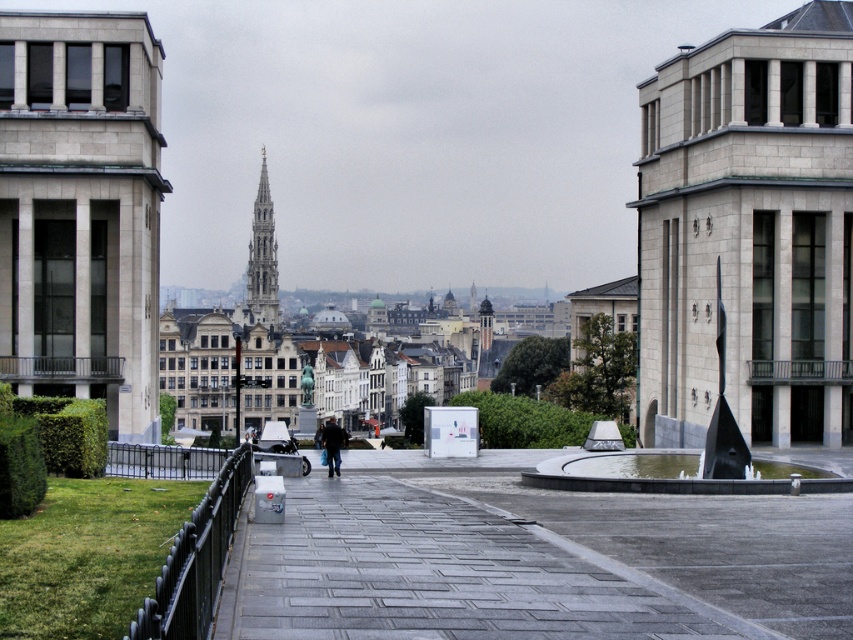
Looking at this image, between gray concrete pavement at center and dark blue jeans at center, which one appears on the right side from the viewer's perspective?

Positioned to the right is gray concrete pavement at center.

Identify the location of gray concrete pavement at center. The height and width of the screenshot is (640, 853). click(x=438, y=573).

Find the location of a particular element. This screenshot has height=640, width=853. gray concrete pavement at center is located at coordinates [438, 573].

Which is below, gray stone sculpture at right or gray concrete pavement at center?

gray concrete pavement at center is below.

Who is taller, gray stone sculpture at right or gray concrete pavement at center?

With more height is gray stone sculpture at right.

Which is behind, point (645, 100) or point (577, 616)?

The point (645, 100) is behind.

This screenshot has width=853, height=640. I want to click on gray stone sculpture at right, so click(749, 230).

Is point (248, 250) less distant than point (329, 474)?

No.

Is smooth stone spire at center shorter than dark blue jeans at center?

In fact, smooth stone spire at center may be taller than dark blue jeans at center.

What do you see at coordinates (262, 259) in the screenshot?
I see `smooth stone spire at center` at bounding box center [262, 259].

You are a GUI agent. You are given a task and a screenshot of the screen. Output one action in this format:
    pyautogui.click(x=<x>, y=<y>)
    Task: Click on the smooth stone spire at center
    The width and height of the screenshot is (853, 640).
    Given the screenshot: What is the action you would take?
    pyautogui.click(x=262, y=259)